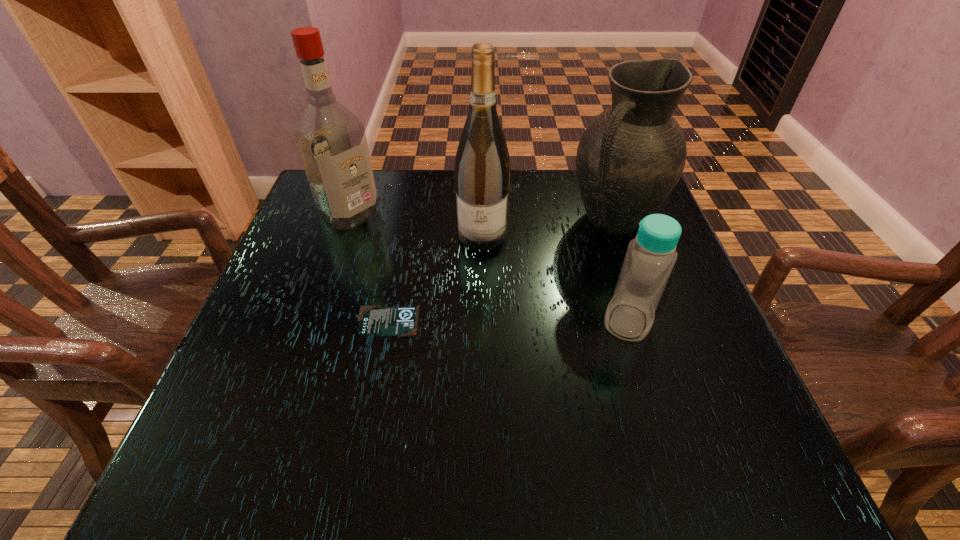
Where is `the fourth object from right to left`? the fourth object from right to left is located at coordinates (374, 320).

Find the location of a particular element. identity card is located at coordinates (374, 320).

Where is `the fourth tallest object`? The width and height of the screenshot is (960, 540). the fourth tallest object is located at coordinates (650, 257).

You are a GUI agent. You are given a task and a screenshot of the screen. Output one action in this format:
    pyautogui.click(x=<x>, y=<y>)
    Task: Click on the pitcher
    This screenshot has height=540, width=960.
    Given the screenshot: What is the action you would take?
    pyautogui.click(x=631, y=156)

I want to click on the leftmost object, so click(331, 140).

The height and width of the screenshot is (540, 960). Identify the location of the third object from left to right. (482, 173).

Where is `vacant space situated 0.050m on the left of the fourth object from right to left`? vacant space situated 0.050m on the left of the fourth object from right to left is located at coordinates (332, 321).

Image resolution: width=960 pixels, height=540 pixels. Find the location of `vacant region located on the left of the fourth tallest object`. vacant region located on the left of the fourth tallest object is located at coordinates (531, 321).

Locate an element on the screen. This screenshot has width=960, height=540. free space located 0.320m on the side of the pitcher with the handle is located at coordinates (502, 321).

The width and height of the screenshot is (960, 540). I want to click on free location located on the side of the pitcher with the handle, so click(x=520, y=304).